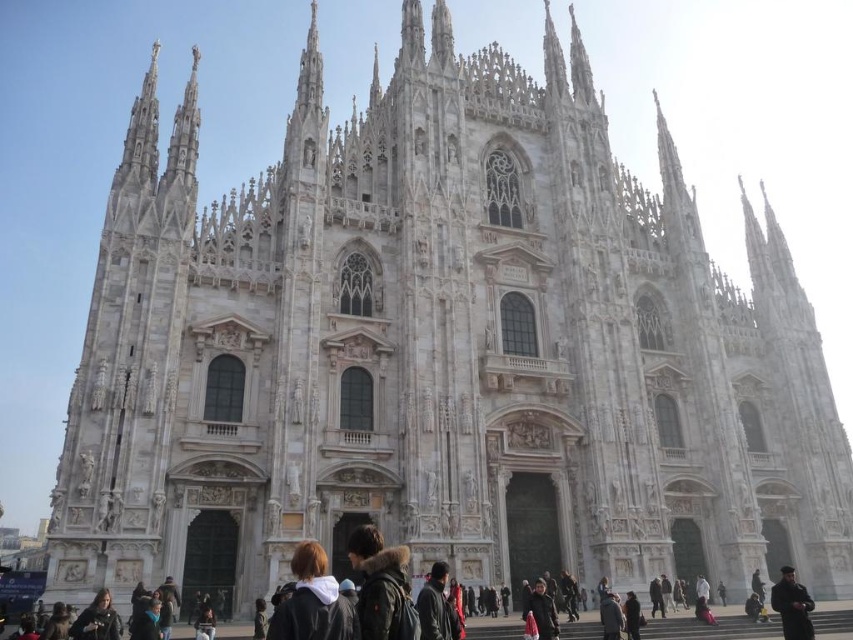
You are a tourist visiting Milan Cathedral and see two jackets in the image. Which jacket is taller, the dark gray jacket at center or the dark brown leather jacket at lower left?

The dark gray jacket at center is taller than the dark brown leather jacket at lower left.

You are a photographer standing in front of the Milan Cathedral. You notice a person with dark brown hair at lower center and another person wearing a dark gray jacket at center. Which of these two people appears wider in the photo?

The dark brown hair at lower center appears wider than the dark gray jacket at center because its width is larger according to the description.